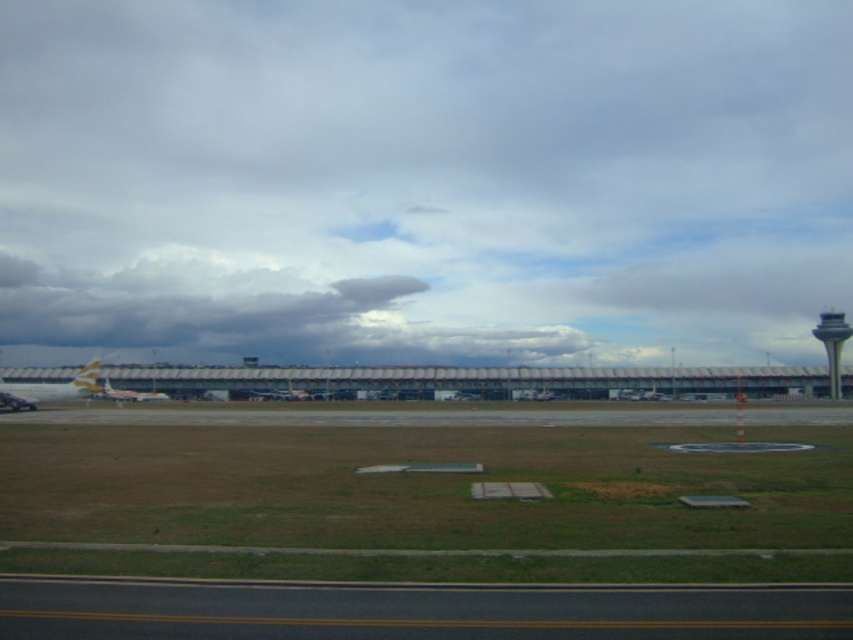
You are standing at the point labeled point (141, 582) and want to walk towards the point labeled point (4, 294). Given that you can only move along the paved road marked by yellow lines in the foreground, will you have to walk uphill or downhill?

Since point (141, 582) is closer to the camera than point (4, 294), you would be walking downhill towards the latter point as you move away from the foreground towards the midground.

You are an airport maintenance worker needing to park a new metallic silver airplane at center that is wider than the white glossy airplane at center. Based on the scene, where would be the best spot to park it without blocking the road?

The metallic silver airplane at center should be parked where there is enough space to accommodate its larger width. Since it is wider than the white glossy airplane at center, positioning it away from the road and towards the grassy area in the foreground would prevent blocking the road while ensuring sufficient space.

You are a pilot preparing to land your plane. You see the black asphalt runway at lower center and the gray concrete control tower at right. Which structure is closer to your current position as you approach the airport?

The black asphalt runway at lower center is closer to your current position because it is in front of the gray concrete control tower at right, indicating it lies along your approach path.